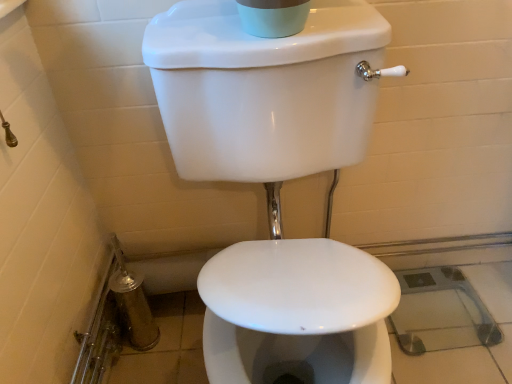
In order to face white glossy toilet at center, should I rotate leftwards or rightwards?

A 4.955 degree turn to the right will do.

What is the approximate height of white glossy toilet at center?

white glossy toilet at center is 37.06 inches tall.

You are a GUI agent. You are given a task and a screenshot of the screen. Output one action in this format:
    pyautogui.click(x=<x>, y=<y>)
    Task: Click on the white glossy toilet at center
    
    Given the screenshot: What is the action you would take?
    pyautogui.click(x=279, y=183)

Image resolution: width=512 pixels, height=384 pixels. Describe the element at coordinates (279, 183) in the screenshot. I see `white glossy toilet at center` at that location.

The width and height of the screenshot is (512, 384). What are the coordinates of `white glossy toilet at center` in the screenshot? It's located at (279, 183).